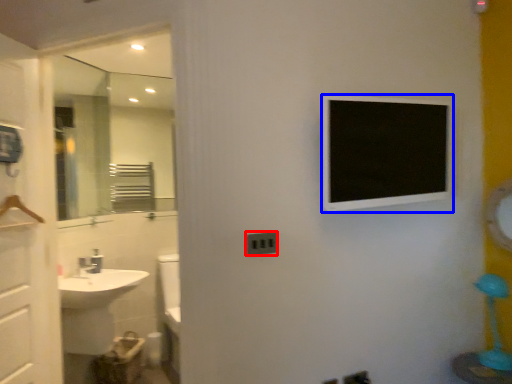
Question: Which object is further to the camera taking this photo, electric outlet (highlighted by a red box) or medicine cabinet (highlighted by a blue box)?

Choices:
 (A) electric outlet
 (B) medicine cabinet

Answer: (A)